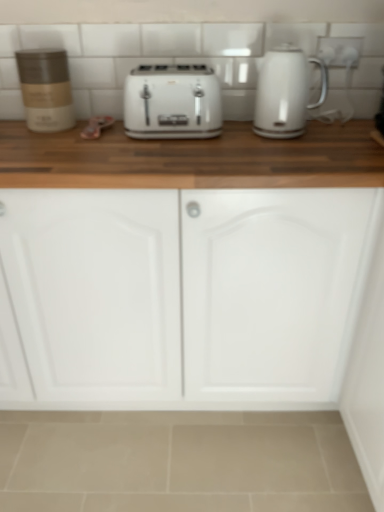
This screenshot has width=384, height=512. What are the coordinates of `free spot in front of white glossy toaster at center` in the screenshot? It's located at (170, 152).